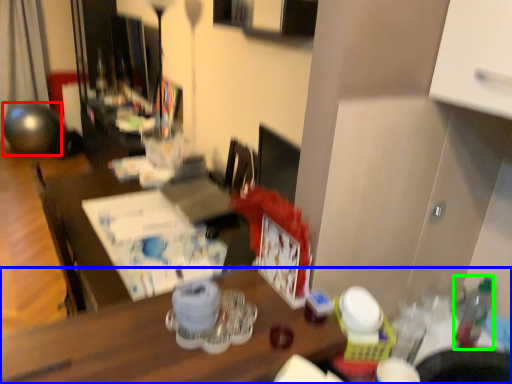
Question: Considering the real-world distances, which object is farthest from ball (highlighted by a red box)? desk (highlighted by a blue box) or bottle (highlighted by a green box)?

Choices:
 (A) desk
 (B) bottle

Answer: (B)